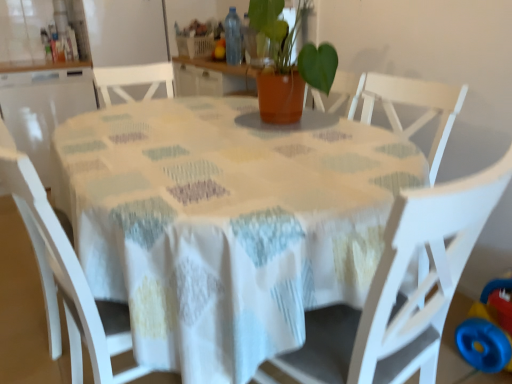
The image size is (512, 384). I want to click on free region on the left part of terracotta pot at center, so click(203, 120).